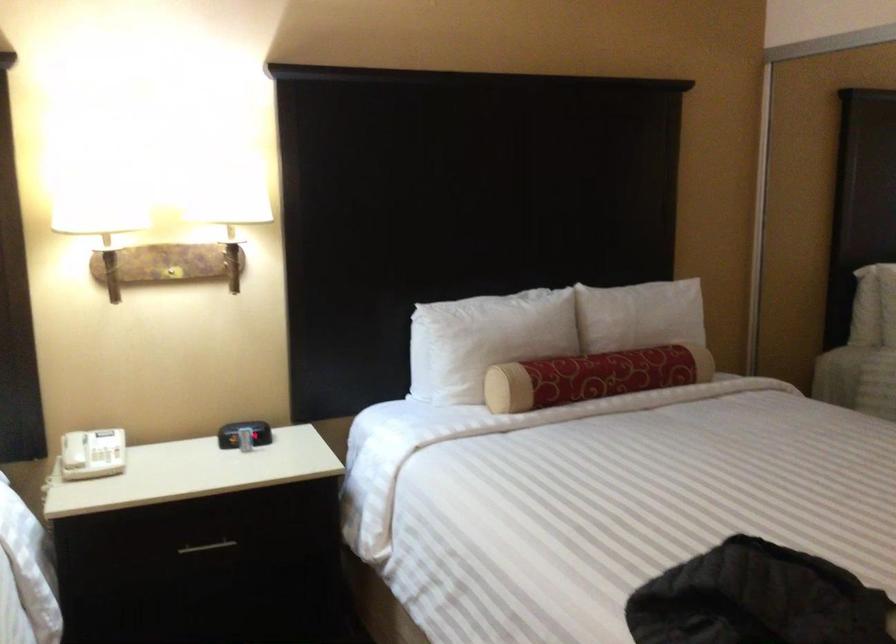
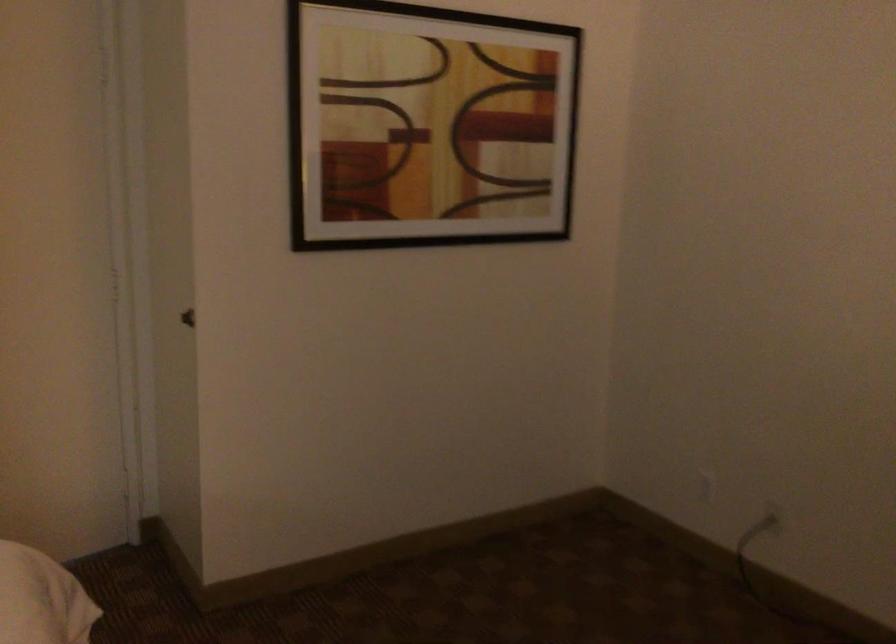
Question: The camera is either moving clockwise (left) or counter-clockwise (right) around the object. The first image is from the beginning of the video and the second image is from the end. Is the camera moving left or right when shooting the video?

Choices:
 (A) Left
 (B) Right

Answer: (A)